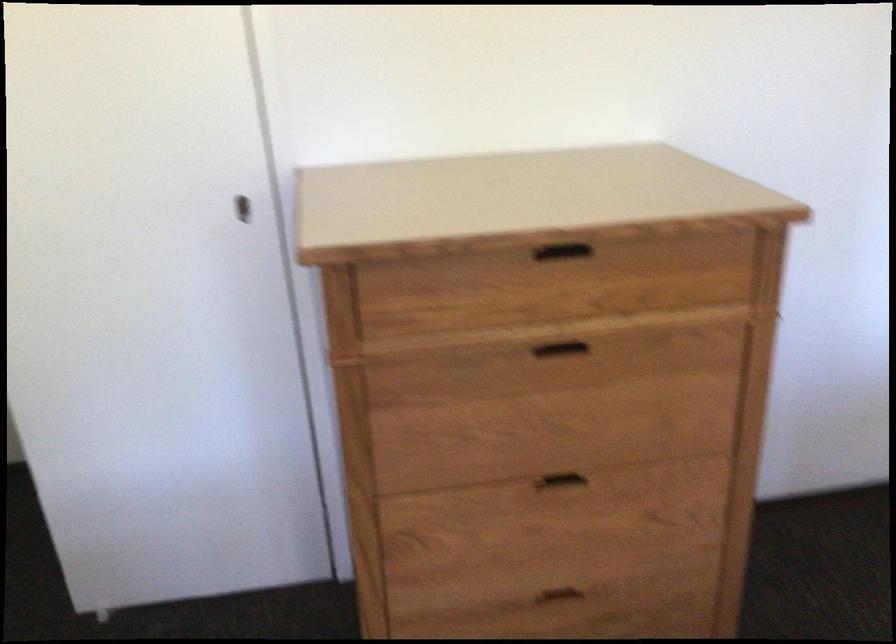
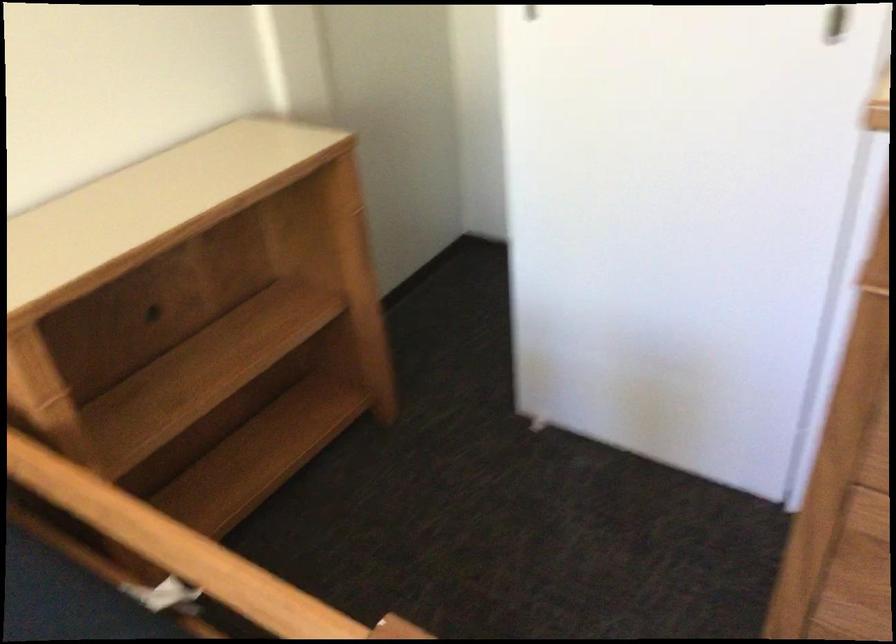
How did the camera likely rotate?

The camera rotated toward left-down.